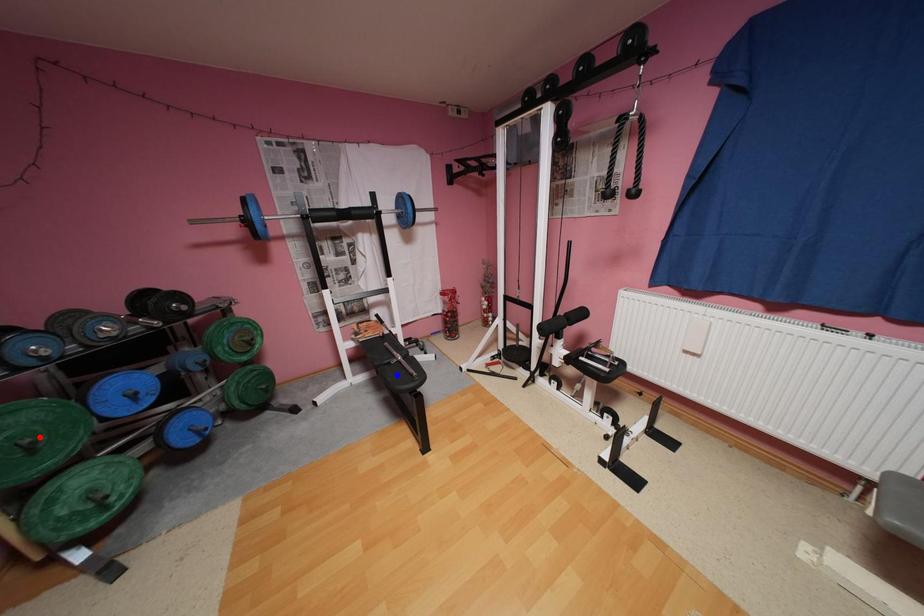
Question: Two points are marked on the image. Which point is closer to the camera?

Choices:
 (A) Blue point is closer.
 (B) Red point is closer.

Answer: (B)